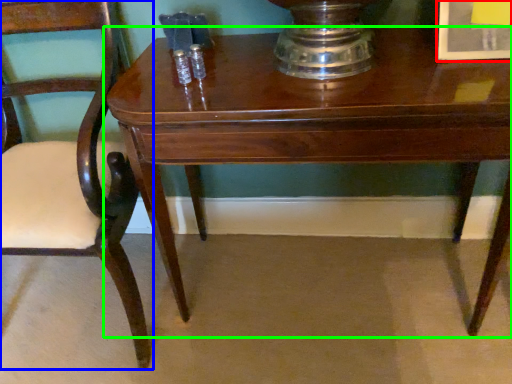
Question: Estimate the real-world distances between objects in this image. Which object is farther from picture frame (highlighted by a red box), chair (highlighted by a blue box) or table (highlighted by a green box)?

Choices:
 (A) chair
 (B) table

Answer: (A)